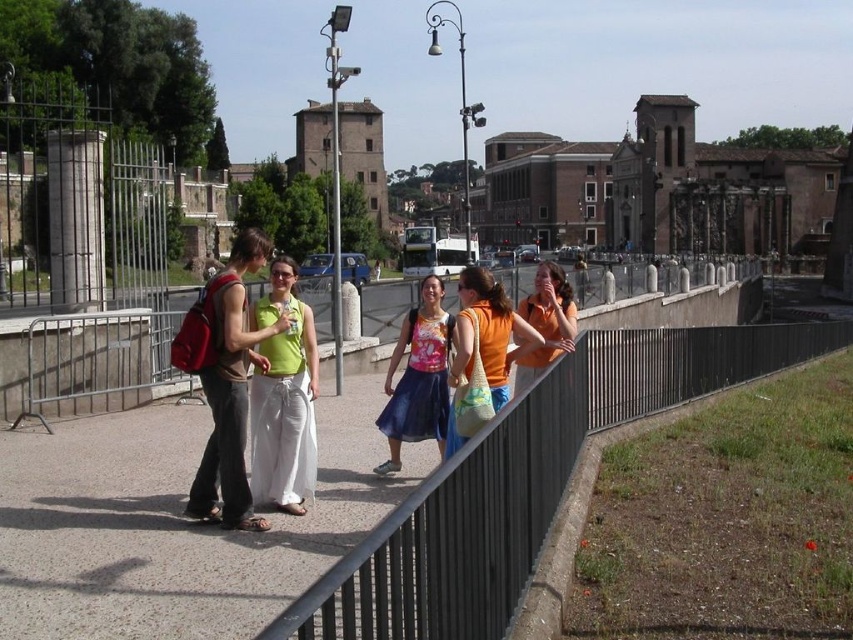
How far apart are orange cotton tote bag at center and natural woven bag at center?

orange cotton tote bag at center and natural woven bag at center are 84.07 centimeters apart from each other.

Does orange cotton tote bag at center appear under natural woven bag at center?

No.

Is point (505, 365) less distant than point (469, 413)?

No, it is behind (469, 413).

Image resolution: width=853 pixels, height=640 pixels. Identify the location of orange cotton tote bag at center. (488, 332).

Is matte green dress at center smaller than natural woven bag at center?

No.

Does matte green dress at center have a larger size compared to natural woven bag at center?

Correct, matte green dress at center is larger in size than natural woven bag at center.

Does point (236, 310) lie behind point (463, 385)?

No.

At what (x,y) coordinates should I click in order to perform the action: click on matte green dress at center. Please return your answer as a coordinate pair (x, y). This screenshot has height=640, width=853. Looking at the image, I should click on (224, 381).

At what (x,y) coordinates should I click in order to perform the action: click on orange cotton shirt at center. Please return your answer as a coordinate pair (x, y). Looking at the image, I should click on (546, 323).

Can you confirm if orange cotton shirt at center is wider than natural woven bag at center?

Indeed, orange cotton shirt at center has a greater width compared to natural woven bag at center.

Who is more distant from viewer, (538, 284) or (476, 420)?

The point (538, 284) is more distant.

Locate an element on the screen. orange cotton shirt at center is located at coordinates (546, 323).